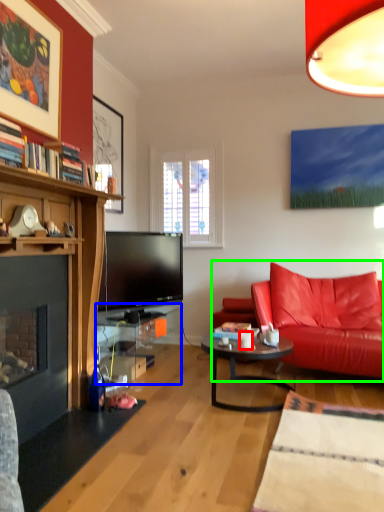
Question: Estimate the real-world distances between objects in this image. Which object is closer to coffee cup (highlighted by a red box), table (highlighted by a blue box) or studio couch (highlighted by a green box)?

Choices:
 (A) table
 (B) studio couch

Answer: (B)